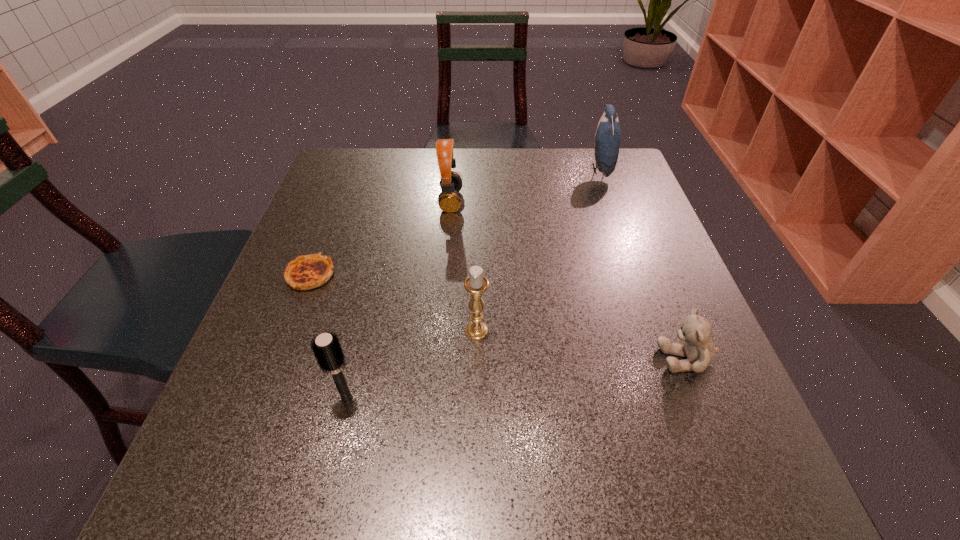
I want to click on vacant space at the far right corner of the desktop, so click(x=620, y=164).

The height and width of the screenshot is (540, 960). What are the coordinates of `empty space that is in between the fifth object from right to left and the second shortest object` in the screenshot? It's located at (516, 379).

Locate an element on the screen. This screenshot has height=540, width=960. free space between the leftmost object and the bird is located at coordinates (455, 222).

The width and height of the screenshot is (960, 540). What are the coordinates of `empty location between the headset and the shortest object` in the screenshot? It's located at (381, 238).

Locate an element on the screen. Image resolution: width=960 pixels, height=540 pixels. vacant area between the fourth nearest object and the headset is located at coordinates (381, 238).

The image size is (960, 540). Find the location of `free space between the candle holder and the third object from left to right`. free space between the candle holder and the third object from left to right is located at coordinates (464, 266).

Identify the location of free space that is in between the shortest object and the fourth object from right to left. (381, 238).

Find the location of a particular element. The width and height of the screenshot is (960, 540). free point between the leftmost object and the fourth object from left to right is located at coordinates [x=394, y=302].

What are the coordinates of `vacant space in between the candle holder and the leftmost object` in the screenshot? It's located at click(394, 302).

Point out which object is positioned as the fifth nearest to the shortest object. Please provide its 2D coordinates. Your answer should be formatted as a tuple, i.e. [(x, y)], where the tuple contains the x and y coordinates of a point satisfying the conditions above.

[(608, 134)]